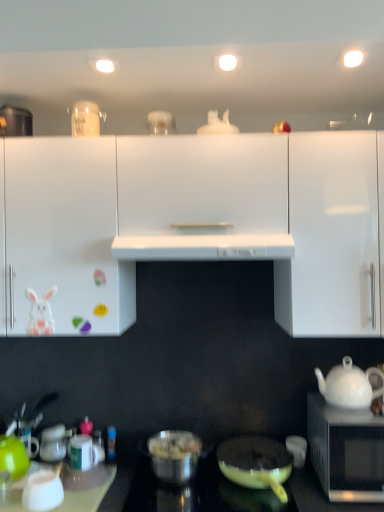
Question: Is white glossy coffee cup at lower right, the first coffee cup in the right-to-left sequence, oriented away from black matte microwave at lower right?

Choices:
 (A) no
 (B) yes

Answer: (A)

Question: Is the position of white glossy coffee cup at lower right, the first coffee cup in the right-to-left sequence, more distant than that of black matte microwave at lower right?

Choices:
 (A) yes
 (B) no

Answer: (A)

Question: Is white glossy coffee cup at lower right, which is counted as the 4th coffee cup, starting from the left, oriented towards black matte microwave at lower right?

Choices:
 (A) no
 (B) yes

Answer: (A)

Question: Does white glossy coffee cup at lower right, which is counted as the 4th coffee cup, starting from the left, appear on the left side of black matte microwave at lower right?

Choices:
 (A) no
 (B) yes

Answer: (B)

Question: Considering the relative sizes of white glossy coffee cup at lower right, the first coffee cup in the right-to-left sequence, and black matte microwave at lower right in the image provided, is white glossy coffee cup at lower right, the first coffee cup in the right-to-left sequence, bigger than black matte microwave at lower right?

Choices:
 (A) no
 (B) yes

Answer: (A)

Question: Considering the relative sizes of white glossy coffee cup at lower right, the first coffee cup in the right-to-left sequence, and black matte microwave at lower right in the image provided, is white glossy coffee cup at lower right, the first coffee cup in the right-to-left sequence, smaller than black matte microwave at lower right?

Choices:
 (A) no
 (B) yes

Answer: (B)

Question: Is white glossy rabbit at left located outside white glossy teapot at right?

Choices:
 (A) yes
 (B) no

Answer: (A)

Question: Is white glossy teapot at right inside white glossy rabbit at left?

Choices:
 (A) no
 (B) yes

Answer: (A)

Question: Can you confirm if white glossy rabbit at left is taller than white glossy teapot at right?

Choices:
 (A) yes
 (B) no

Answer: (B)

Question: From a real-world perspective, is white glossy rabbit at left on white glossy teapot at right?

Choices:
 (A) yes
 (B) no

Answer: (A)

Question: Is white glossy rabbit at left wider than white glossy teapot at right?

Choices:
 (A) no
 (B) yes

Answer: (A)

Question: From the image's perspective, does white glossy rabbit at left appear lower than white glossy teapot at right?

Choices:
 (A) yes
 (B) no

Answer: (B)

Question: Are matte yellow pan at lower center, the 1th pot/pan positioned from the right, and white glossy exhaust hood at center beside each other?

Choices:
 (A) no
 (B) yes

Answer: (A)